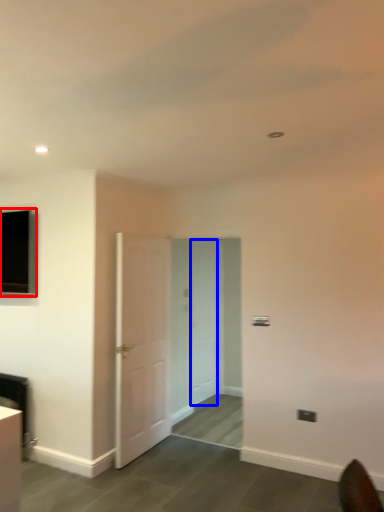
Question: Which point is closer to the camera, window (highlighted by a red box) or door (highlighted by a blue box)?

Choices:
 (A) window
 (B) door

Answer: (A)